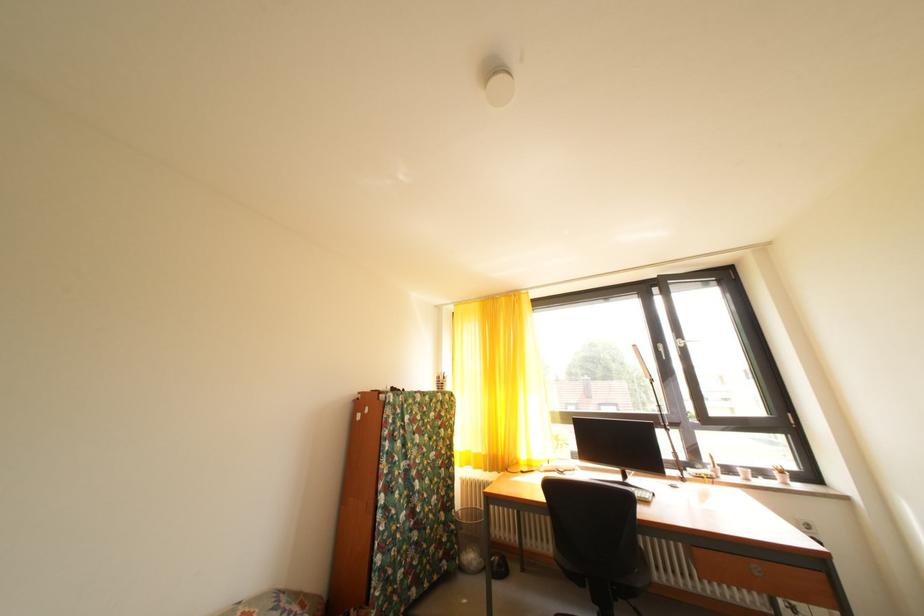
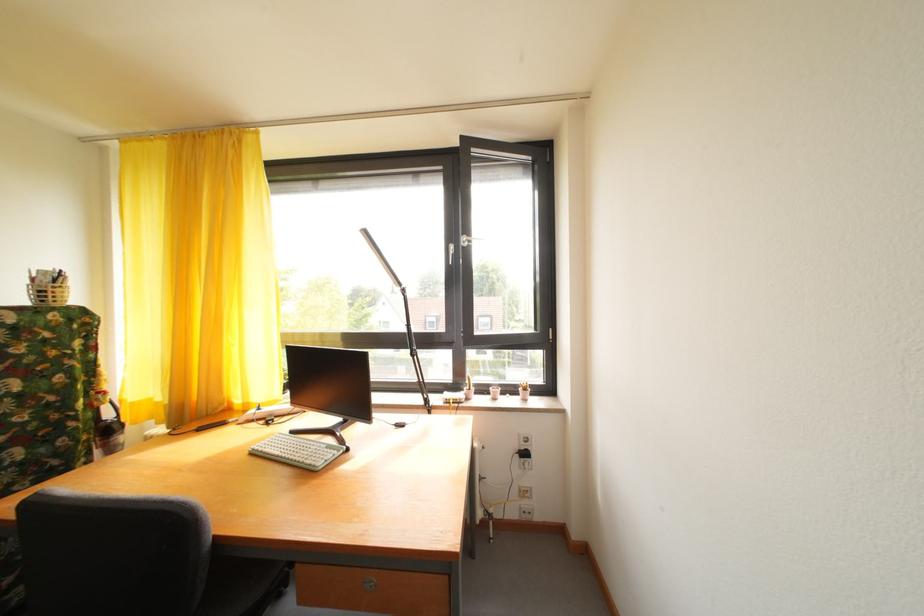
Find the pixel in the second image that matches point 737,476 in the first image.

(492, 395)